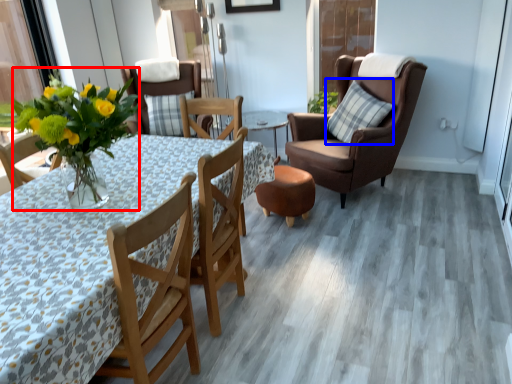
Question: Which point is further to the camera, floral arrangement (highlighted by a red box) or pillow (highlighted by a blue box)?

Choices:
 (A) floral arrangement
 (B) pillow

Answer: (B)